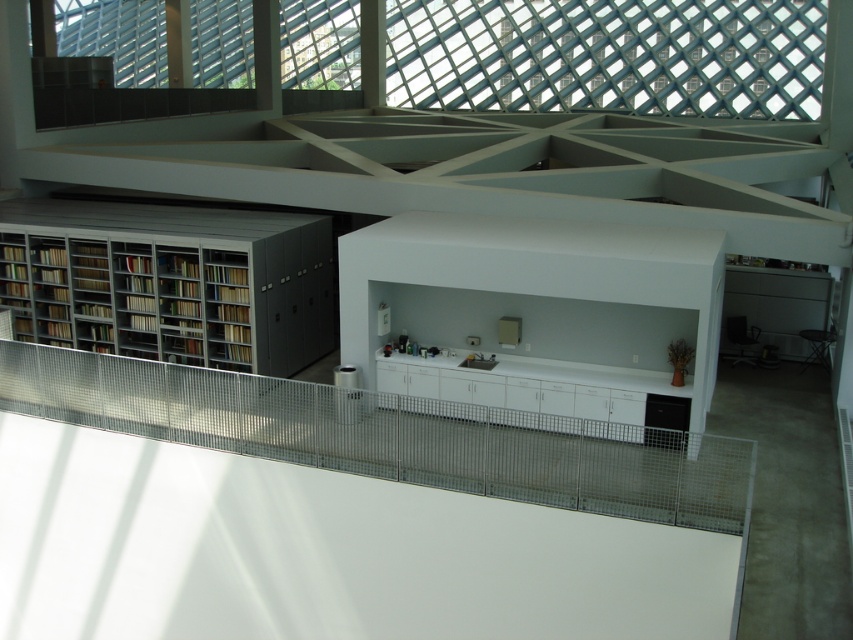
Question: Can you confirm if transparent glass window at upper center is bigger than matte gray bookcase at left?

Choices:
 (A) yes
 (B) no

Answer: (A)

Question: Observing the image, what is the correct spatial positioning of transparent glass window at upper center in reference to matte gray bookcase at left?

Choices:
 (A) below
 (B) above

Answer: (B)

Question: Does transparent glass window at upper center lie behind matte gray bookcase at left?

Choices:
 (A) no
 (B) yes

Answer: (B)

Question: Which point is closer to the camera taking this photo?

Choices:
 (A) (744, 115)
 (B) (225, 272)

Answer: (B)

Question: Among these points, which one is nearest to the camera?

Choices:
 (A) (100, 225)
 (B) (434, 93)

Answer: (A)